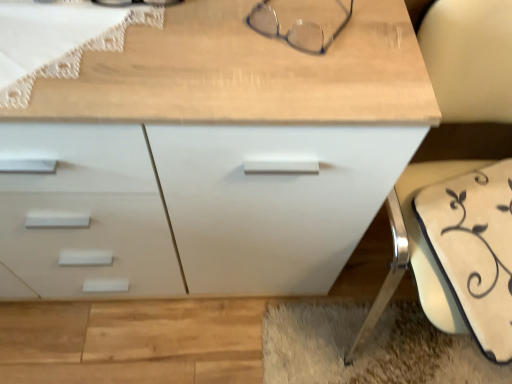
Question: Does white matte chest of drawers at center have a lesser width compared to clear plastic glasses at upper center?

Choices:
 (A) no
 (B) yes

Answer: (A)

Question: Considering the relative positions of white matte chest of drawers at center and clear plastic glasses at upper center in the image provided, is white matte chest of drawers at center to the right of clear plastic glasses at upper center from the viewer's perspective?

Choices:
 (A) no
 (B) yes

Answer: (A)

Question: Is white matte chest of drawers at center positioned in front of clear plastic glasses at upper center?

Choices:
 (A) no
 (B) yes

Answer: (B)

Question: Does white matte chest of drawers at center appear on the left side of clear plastic glasses at upper center?

Choices:
 (A) yes
 (B) no

Answer: (A)

Question: From the image's perspective, is white matte chest of drawers at center located beneath clear plastic glasses at upper center?

Choices:
 (A) yes
 (B) no

Answer: (A)

Question: Considering their positions, is white matte chest of drawers at center located in front of or behind white fabric swivel chair at lower right?

Choices:
 (A) front
 (B) behind

Answer: (B)

Question: Considering the positions of white matte chest of drawers at center and white fabric swivel chair at lower right in the image, is white matte chest of drawers at center bigger or smaller than white fabric swivel chair at lower right?

Choices:
 (A) big
 (B) small

Answer: (A)

Question: From the image's perspective, is white matte chest of drawers at center located above or below white fabric swivel chair at lower right?

Choices:
 (A) below
 (B) above

Answer: (B)

Question: Looking at their shapes, would you say white matte chest of drawers at center is wider or thinner than white fabric swivel chair at lower right?

Choices:
 (A) thin
 (B) wide

Answer: (A)

Question: Is white matte chest of drawers at center in front of or behind clear plastic glasses at upper center in the image?

Choices:
 (A) front
 (B) behind

Answer: (A)

Question: From a real-world perspective, is white matte chest of drawers at center positioned above or below clear plastic glasses at upper center?

Choices:
 (A) below
 (B) above

Answer: (A)

Question: Based on their positions, is white matte chest of drawers at center located to the left or right of clear plastic glasses at upper center?

Choices:
 (A) left
 (B) right

Answer: (A)

Question: Is white matte chest of drawers at center bigger or smaller than clear plastic glasses at upper center?

Choices:
 (A) big
 (B) small

Answer: (A)

Question: In terms of width, does white fabric swivel chair at lower right look wider or thinner when compared to clear plastic glasses at upper center?

Choices:
 (A) thin
 (B) wide

Answer: (B)

Question: From a real-world perspective, relative to clear plastic glasses at upper center, is white fabric swivel chair at lower right vertically above or below?

Choices:
 (A) above
 (B) below

Answer: (B)